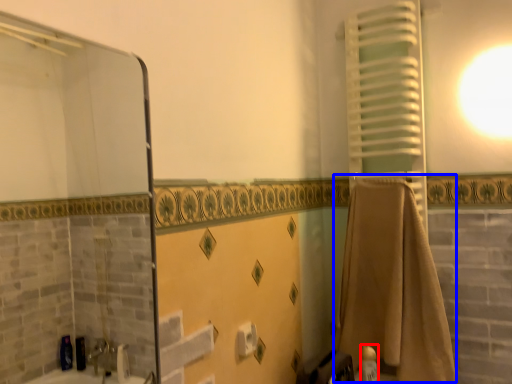
Question: Which object is further to the camera taking this photo, toiletry (highlighted by a red box) or bath towel (highlighted by a blue box)?

Choices:
 (A) toiletry
 (B) bath towel

Answer: (A)